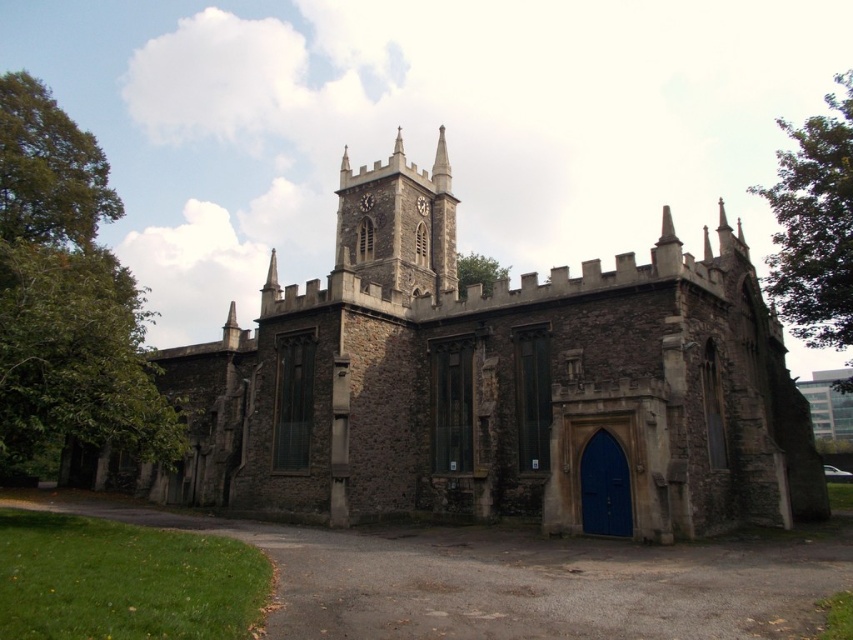
Does dark gray stone clock tower at center appear on the left side of blue matte door at center?

Indeed, dark gray stone clock tower at center is positioned on the left side of blue matte door at center.

Who is lower down, dark gray stone clock tower at center or blue matte door at center?

blue matte door at center is lower down.

The height and width of the screenshot is (640, 853). What do you see at coordinates (398, 224) in the screenshot?
I see `dark gray stone clock tower at center` at bounding box center [398, 224].

The width and height of the screenshot is (853, 640). Find the location of `dark gray stone clock tower at center`. dark gray stone clock tower at center is located at coordinates (398, 224).

Is blue matte door at center shorter than metallic clock at center?

Correct, blue matte door at center is not as tall as metallic clock at center.

Based on the photo, who is higher up, blue matte door at center or metallic clock at center?

Positioned higher is metallic clock at center.

Identify the location of blue matte door at center. The height and width of the screenshot is (640, 853). (x=604, y=486).

What are the coordinates of `blue matte door at center` in the screenshot? It's located at (604, 486).

This screenshot has height=640, width=853. What are the coordinates of `stone church at center` in the screenshot? It's located at (486, 385).

Can you confirm if stone church at center is smaller than metallic clock at center?

Actually, stone church at center might be larger than metallic clock at center.

The height and width of the screenshot is (640, 853). In order to click on stone church at center in this screenshot , I will do `click(486, 385)`.